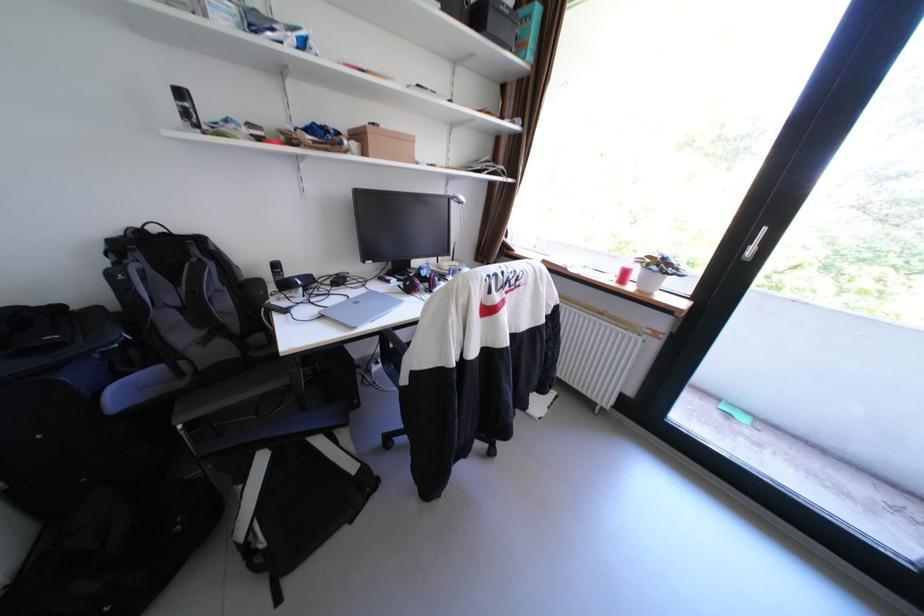
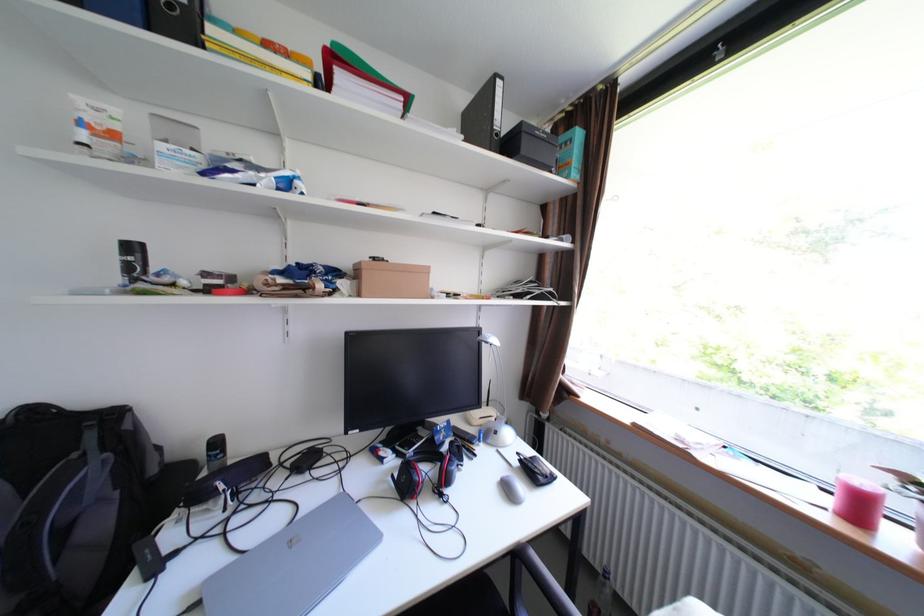
In the second image, find the point that corresponds to the point at 192,95 in the first image.

(143, 248)